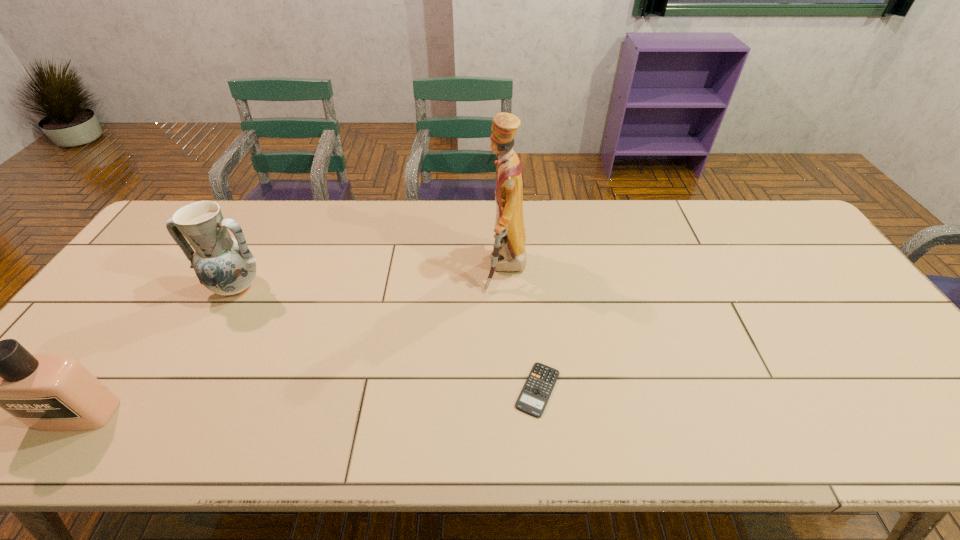
Find the location of `nutcracker`. nutcracker is located at coordinates (509, 255).

The height and width of the screenshot is (540, 960). Identify the location of the third object from right to left. point(224,265).

Locate an element on the screen. the leftmost object is located at coordinates (47, 392).

The image size is (960, 540). I want to click on calculator, so point(534,396).

Locate an element on the screen. Image resolution: width=960 pixels, height=540 pixels. free space located 0.370m on the front-facing side of the nutcracker is located at coordinates (360, 268).

At what (x,y) coordinates should I click in order to perform the action: click on vacant area located on the front-facing side of the nutcracker. Please return your answer as a coordinate pair (x, y). This screenshot has width=960, height=540. Looking at the image, I should click on (390, 268).

Locate an element on the screen. This screenshot has height=540, width=960. free space located 0.130m on the front-facing side of the nutcracker is located at coordinates (441, 268).

Locate an element on the screen. Image resolution: width=960 pixels, height=540 pixels. vacant area situated 0.070m on either side of the pottery is located at coordinates (215, 326).

The height and width of the screenshot is (540, 960). I want to click on free space located on the left of the shortest object, so click(402, 389).

Where is `perfume present at the near edge`? The height and width of the screenshot is (540, 960). perfume present at the near edge is located at coordinates click(47, 392).